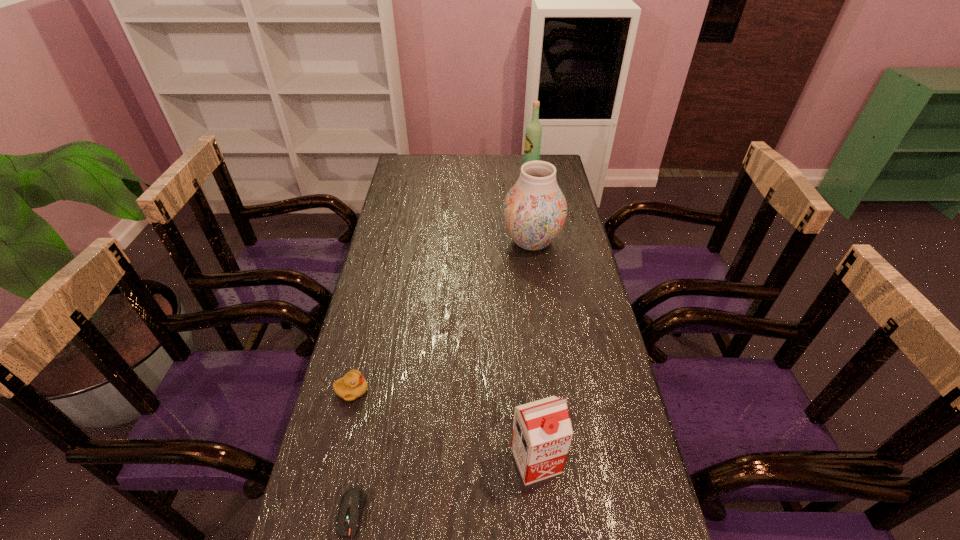
Image resolution: width=960 pixels, height=540 pixels. What are the coordinates of `vacant space situated 0.180m on the front-facing side of the farthest object` in the screenshot? It's located at (482, 171).

Identify the location of free region located 0.060m on the right of the fourth nearest object. This screenshot has width=960, height=540. (579, 242).

I want to click on vacant area located on the front of the fourth farthest object, so click(x=541, y=521).

Where is `vacant region located at the beak of the duckling`? vacant region located at the beak of the duckling is located at coordinates (469, 390).

Where is `object present at the far edge`? The image size is (960, 540). object present at the far edge is located at coordinates (533, 135).

What are the coordinates of `duckling positioned at the left edge` in the screenshot? It's located at (353, 385).

This screenshot has width=960, height=540. Find the location of `computer equipment present at the left edge`. computer equipment present at the left edge is located at coordinates coord(353,501).

Image resolution: width=960 pixels, height=540 pixels. I want to click on wine bottle that is positioned at the right edge, so click(x=533, y=135).

Identify the location of vase present at the right edge. (534, 210).

Locate an element on the screen. The image size is (960, 540). object that is at the far right corner is located at coordinates (533, 135).